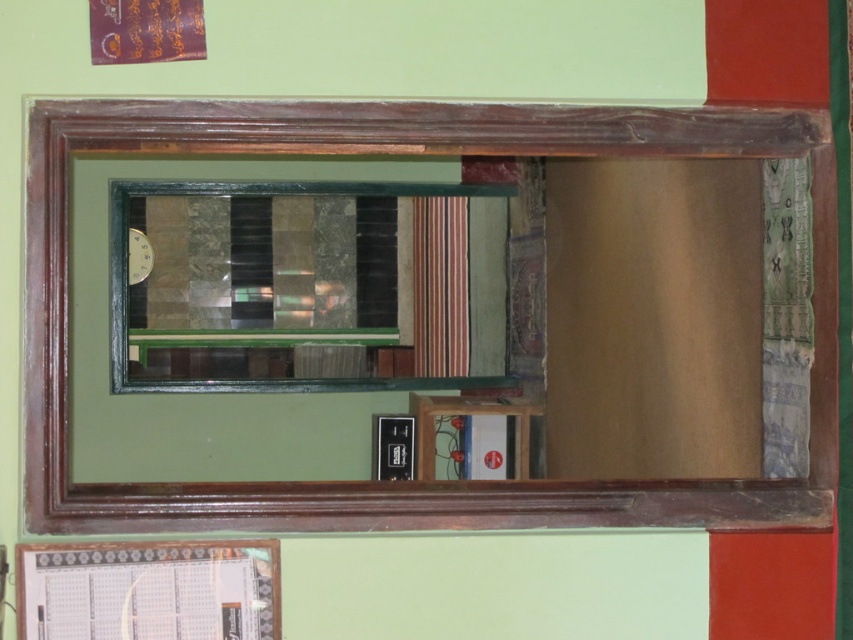
Question: Among these objects, which one is farthest from the camera?

Choices:
 (A) wooden mirror at center
 (B) green glass window at center

Answer: (B)

Question: Can you confirm if wooden mirror at center is wider than green glass window at center?

Choices:
 (A) yes
 (B) no

Answer: (B)

Question: Which point is closer to the camera?

Choices:
 (A) green glass window at center
 (B) wooden mirror at center

Answer: (B)

Question: Is wooden mirror at center to the left of green glass window at center from the viewer's perspective?

Choices:
 (A) no
 (B) yes

Answer: (A)

Question: Does wooden mirror at center have a lesser width compared to green glass window at center?

Choices:
 (A) no
 (B) yes

Answer: (B)